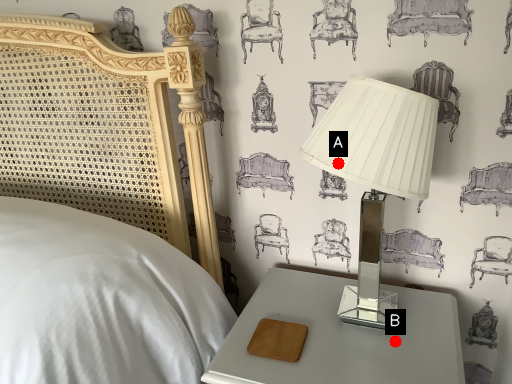
Question: Two points are circled on the image, labeled by A and B beside each circle. Which point is closer to the camera taking this photo?

Choices:
 (A) A is closer
 (B) B is closer

Answer: (A)